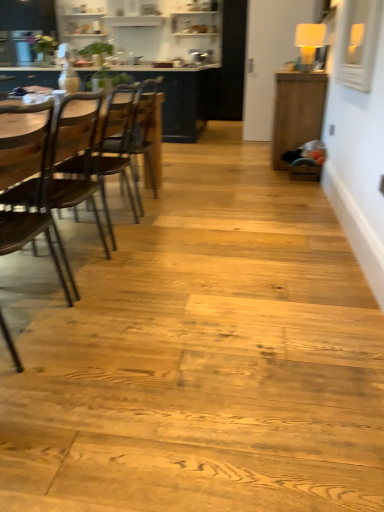
Question: Is wooden chair at left, which appears as the 1th chair when viewed from the front, to the right of wooden cabinet at right, acting as the second table starting from the left, from the viewer's perspective?

Choices:
 (A) no
 (B) yes

Answer: (A)

Question: From a real-world perspective, is wooden chair at left, arranged as the 2th chair when viewed from the back, on wooden cabinet at right, which is counted as the first table, starting from the right?

Choices:
 (A) yes
 (B) no

Answer: (A)

Question: Is wooden chair at left, arranged as the 2th chair when viewed from the back, touching wooden cabinet at right, placed as the 2th table when sorted from back to front?

Choices:
 (A) no
 (B) yes

Answer: (A)

Question: Is wooden chair at left, which appears as the 1th chair when viewed from the front, not close to wooden cabinet at right, the 1th table in the front-to-back sequence?

Choices:
 (A) no
 (B) yes

Answer: (B)

Question: From a real-world perspective, is wooden chair at left, which appears as the 1th chair when viewed from the front, positioned under wooden cabinet at right, acting as the second table starting from the left, based on gravity?

Choices:
 (A) no
 (B) yes

Answer: (A)

Question: Is wooden cabinet at right, acting as the second table starting from the left, in front of or behind wooden table at left, which is the 1th table from back to front, in the image?

Choices:
 (A) behind
 (B) front

Answer: (B)

Question: Looking at their shapes, would you say wooden cabinet at right, acting as the second table starting from the left, is wider or thinner than wooden table at left, which is the 1th table from back to front?

Choices:
 (A) thin
 (B) wide

Answer: (A)

Question: Is point (296, 124) positioned closer to the camera than point (195, 128)?

Choices:
 (A) farther
 (B) closer

Answer: (B)

Question: In the image, is wooden cabinet at right, placed as the 2th table when sorted from back to front, on the left side or the right side of wooden table at left, which is the 1th table from back to front?

Choices:
 (A) right
 (B) left

Answer: (A)

Question: Based on their sizes in the image, would you say wooden table at left, which is the 1th table from back to front, is bigger or smaller than wooden cabinet at right, the 1th table in the front-to-back sequence?

Choices:
 (A) big
 (B) small

Answer: (A)

Question: Do you think wooden table at left, which is the 1th table from back to front, is within wooden cabinet at right, which is counted as the first table, starting from the right, or outside of it?

Choices:
 (A) outside
 (B) inside

Answer: (A)

Question: From the image's perspective, is wooden table at left, which is counted as the 2th table, starting from the front, located above or below wooden cabinet at right, the 1th table in the front-to-back sequence?

Choices:
 (A) below
 (B) above

Answer: (B)

Question: In terms of width, does wooden table at left, acting as the first table starting from the left, look wider or thinner when compared to wooden cabinet at right, the 1th table in the front-to-back sequence?

Choices:
 (A) thin
 (B) wide

Answer: (B)

Question: Considering the positions of point (276, 159) and point (52, 152), is point (276, 159) closer or farther from the camera than point (52, 152)?

Choices:
 (A) farther
 (B) closer

Answer: (A)

Question: From the image's perspective, is wooden cabinet at right, the 1th table in the front-to-back sequence, positioned above or below wooden chair at left, which appears as the 1th chair when viewed from the front?

Choices:
 (A) above
 (B) below

Answer: (A)